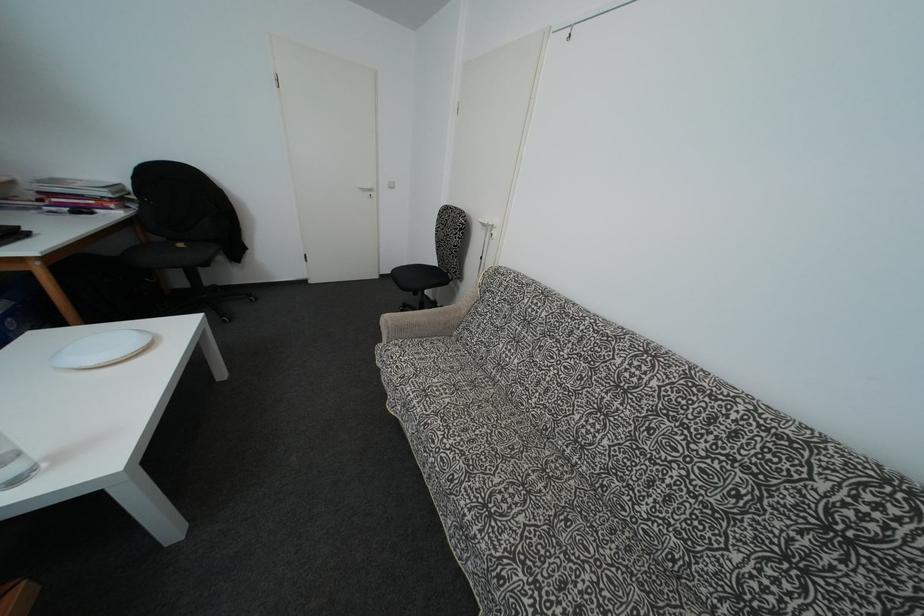
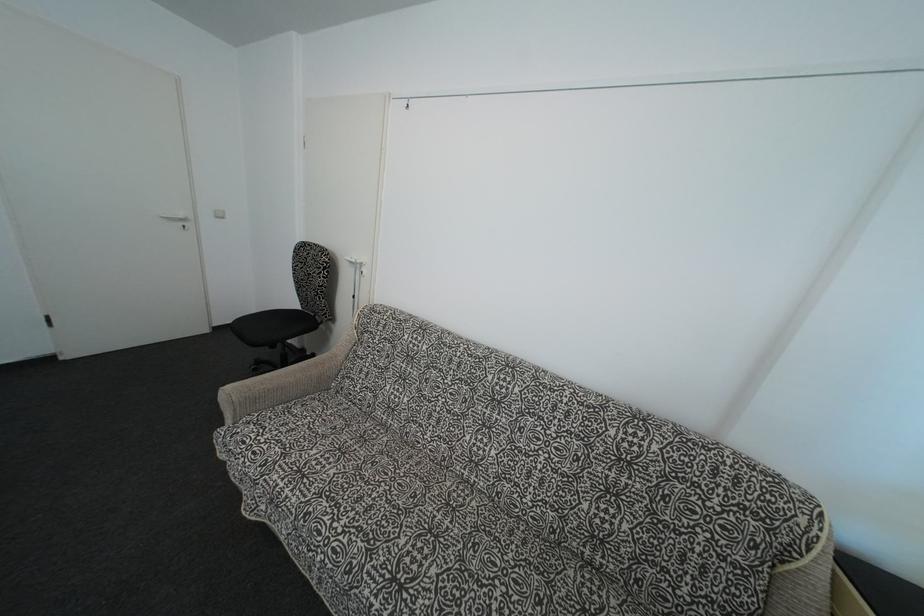
The point at (436, 267) is marked in the first image. Where is the corresponding point in the second image?

(297, 310)